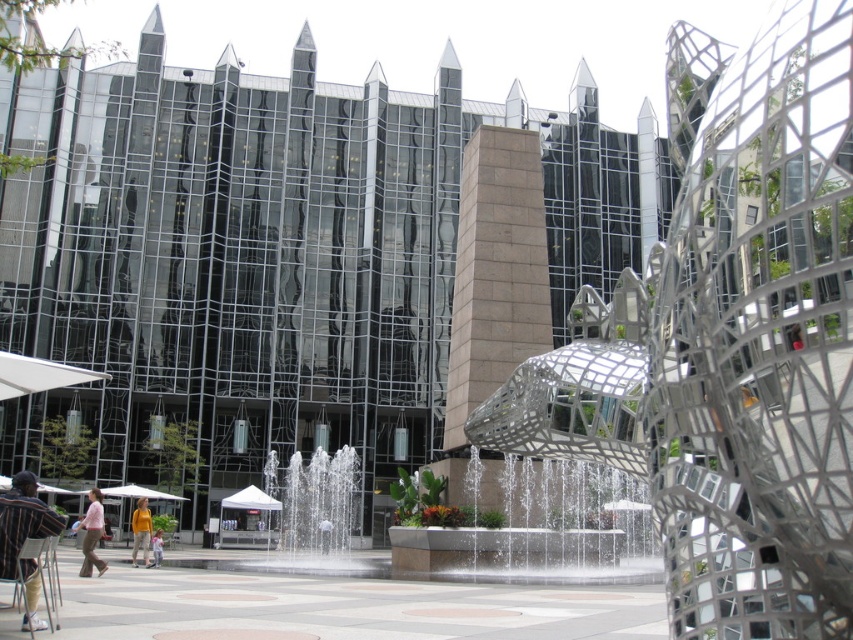
Question: Where is pink fabric pants at lower left located in relation to white fabric umbrella at center in the image?

Choices:
 (A) left
 (B) right

Answer: (A)

Question: Can you confirm if white matte umbrella at lower left is bigger than orange shirt at lower left?

Choices:
 (A) no
 (B) yes

Answer: (B)

Question: Which object is the farthest from the striped cotton shirt at lower left?

Choices:
 (A) yellow cotton shirt at center
 (B) pink fabric pants at lower left

Answer: (A)

Question: Which point appears closest to the camera in this image?

Choices:
 (A) (6, 376)
 (B) (154, 563)
 (C) (85, 541)
 (D) (314, 548)

Answer: (A)

Question: Is striped cotton shirt at lower left below orange shirt at lower left?

Choices:
 (A) yes
 (B) no

Answer: (B)

Question: Which object appears farthest from the camera in this image?

Choices:
 (A) striped cotton shirt at lower left
 (B) pink fabric pants at lower left

Answer: (B)